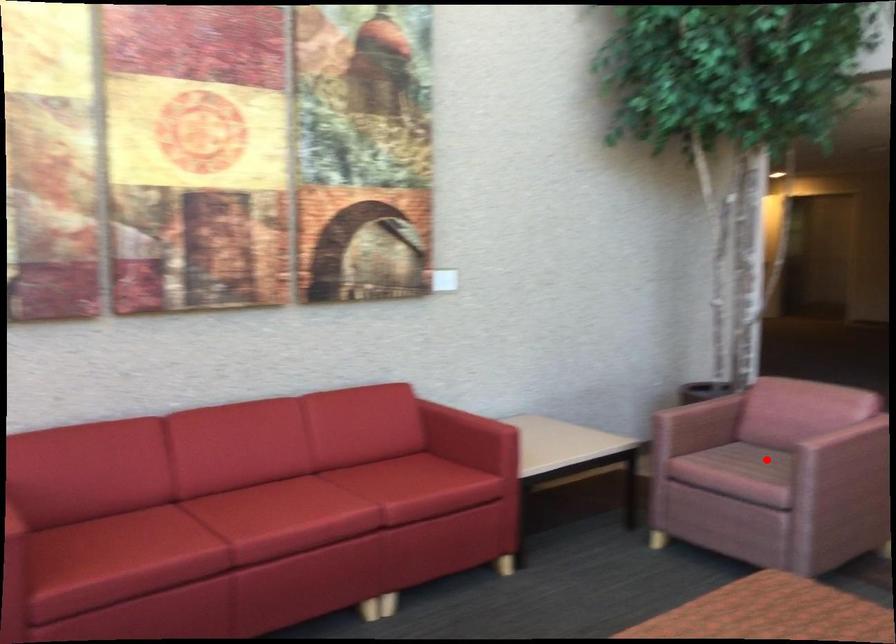
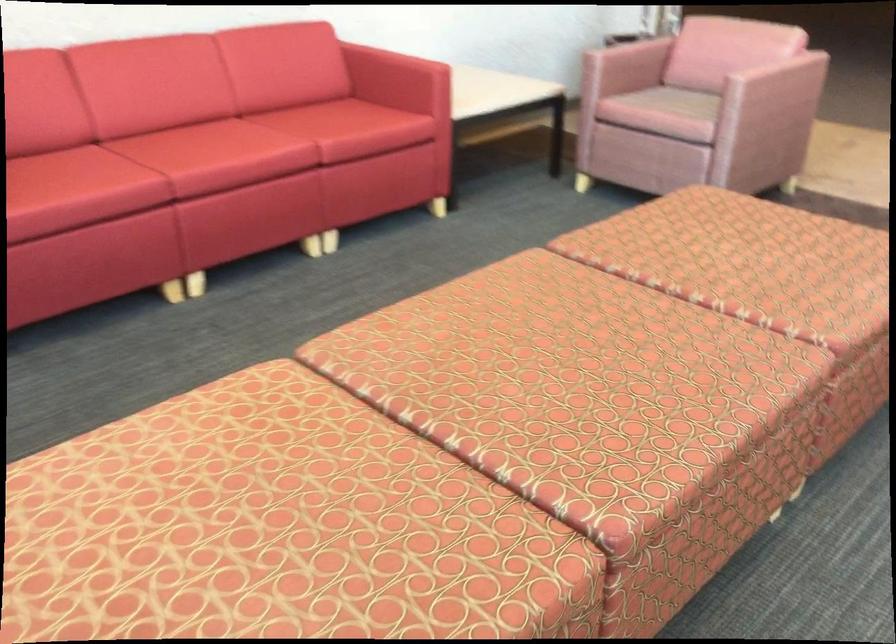
Locate, in the second image, the point that corresponds to the highlighted location in the first image.

(686, 102)